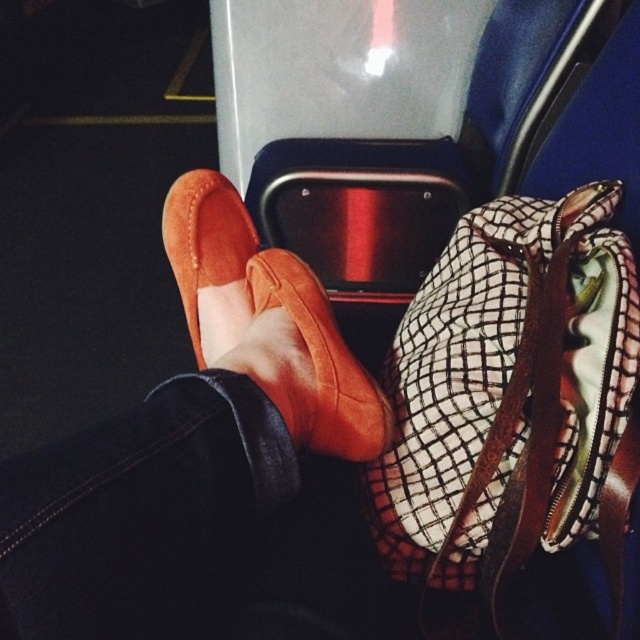
Is suede orange loafers at center bigger than plaid fabric bag at center?

Indeed, suede orange loafers at center has a larger size compared to plaid fabric bag at center.

Does suede orange loafers at center appear over plaid fabric bag at center?

No, suede orange loafers at center is not above plaid fabric bag at center.

Who is more distant from viewer, (339, 371) or (497, 208)?

Positioned behind is point (497, 208).

Find the location of a particular element. The height and width of the screenshot is (640, 640). suede orange loafers at center is located at coordinates (186, 445).

Can you confirm if suede orange slip-on shoe at center is positioned above suede orange shoe at center?

Incorrect, suede orange slip-on shoe at center is not positioned above suede orange shoe at center.

Is point (276, 259) positioned behind point (230, 246)?

That is False.

Is point (332, 356) positioned before point (182, 278)?

Yes, point (332, 356) is in front of point (182, 278).

Identify the location of suede orange slip-on shoe at center. Image resolution: width=640 pixels, height=640 pixels. (268, 321).

Between point (24, 497) and point (205, 276), which one is positioned in front?

Point (24, 497)

Measure the distance between suede orange loafers at center and camera.

suede orange loafers at center is 31.44 centimeters away from camera.

This screenshot has width=640, height=640. In order to click on suede orange loafers at center in this screenshot , I will do `click(186, 445)`.